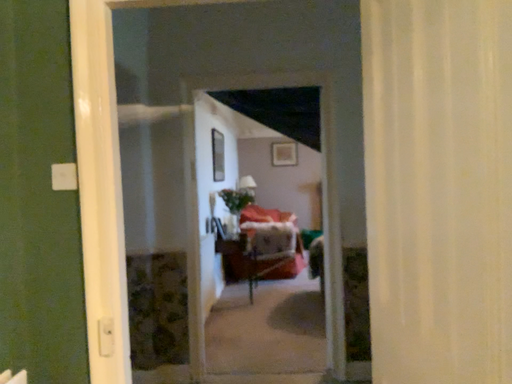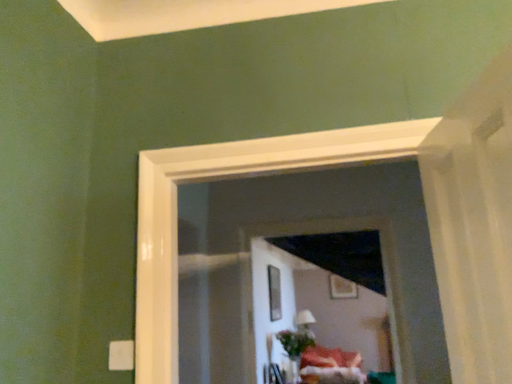
Question: How did the camera likely rotate when shooting the video?

Choices:
 (A) rotated right
 (B) rotated left

Answer: (B)